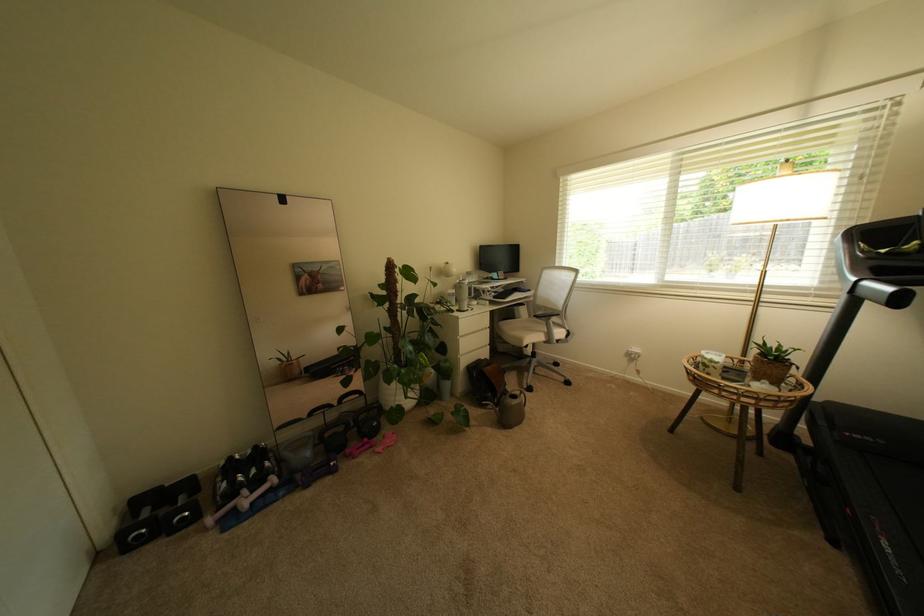
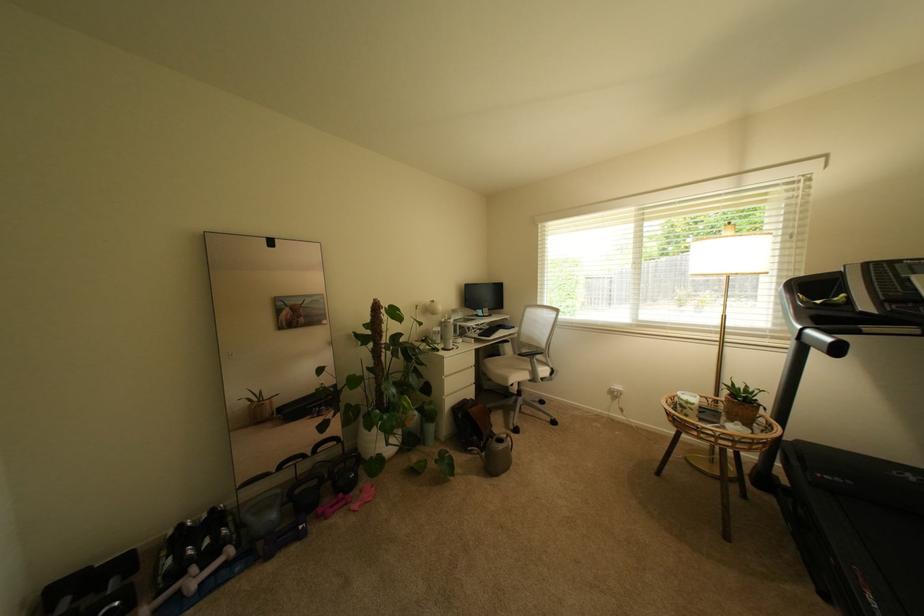
Locate, in the second image, the point that corresponds to [469,353] in the first image.

(455, 392)